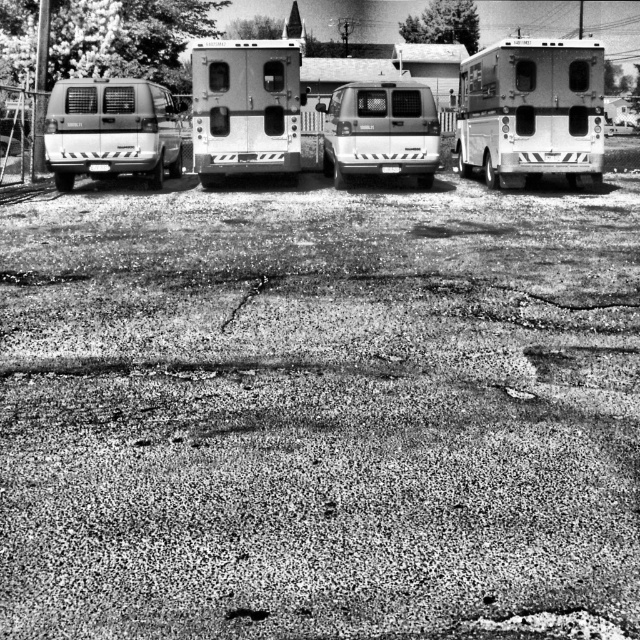
Who is more forward, (266, 54) or (424, 96)?

Positioned in front is point (266, 54).

Is metallic silver camper at center positioned at the back of white matte van at center?

No, it is in front of white matte van at center.

The height and width of the screenshot is (640, 640). I want to click on metallic silver camper at center, so click(x=244, y=108).

Is metallic silver camper at right in front of white matte van at center?

Yes, metallic silver camper at right is closer to the viewer.

Who is more forward, (496, 48) or (348, 150)?

Positioned in front is point (348, 150).

Where is `metallic silver camper at right`? The image size is (640, 640). metallic silver camper at right is located at coordinates (531, 109).

Between metallic silver camper at right and matte white van at left, which one has more height?

metallic silver camper at right is taller.

Between point (586, 132) and point (145, 99), which one is positioned behind?

The point (586, 132) is behind.

Between point (460, 72) and point (124, 129), which one is positioned in front?

Positioned in front is point (124, 129).

You are a GUI agent. You are given a task and a screenshot of the screen. Output one action in this format:
    pyautogui.click(x=<x>, y=<y>)
    Task: Click on the metallic silver camper at right
    This screenshot has width=640, height=640.
    Given the screenshot: What is the action you would take?
    pyautogui.click(x=531, y=109)